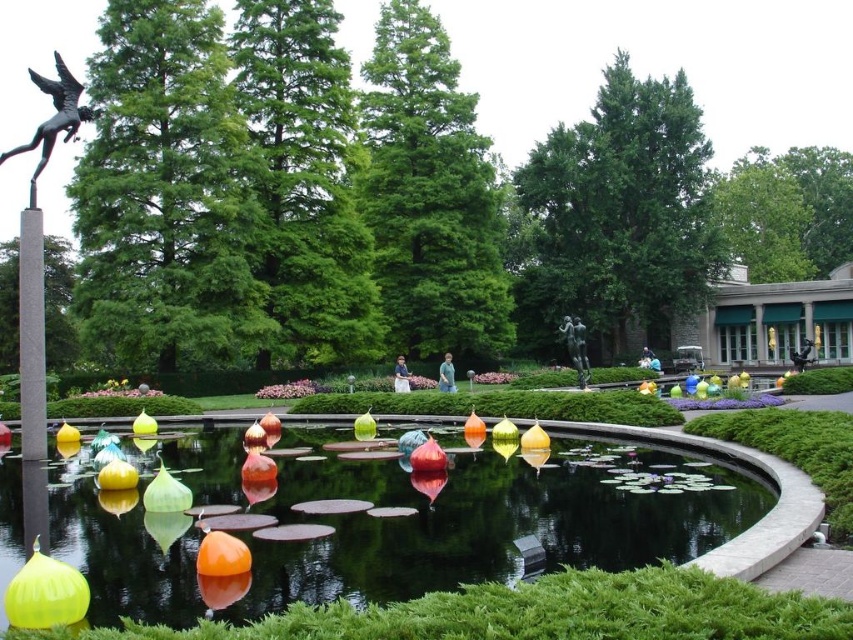
You are standing in the garden and want to take a photo of the translucent glass pond at center. If your camera has a maximum focus range of 25 feet, will you be able to focus on the pond clearly?

The translucent glass pond at center is 24.69 feet away from viewer, so yes, the camera can focus on it clearly since the distance is within the 25 feet range.

You are a landscape architect designing a new garden. You need to place a bench so that it is exactly 8 meters away from the translucent glass pond at center. Based on the scene description, is this possible?

The translucent glass pond at center is 7.53 meters away from the camera. Since the bench needs to be placed exactly 8 meters away from the pond, it would be slightly further than the current distance from the camera. This is feasible as long as there is enough space beyond the current camera position to accommodate the additional 0.47 meters required.

You are a visitor in the garden and want to take a photo of the translucent glass pond at center and the polished bronze bird at upper left. Which object should you focus on first if you want to capture both in a single frame without moving the camera?

The polished bronze bird at upper left should be focused on first since it is above the translucent glass pond at center, allowing both to be in the frame when positioned correctly.